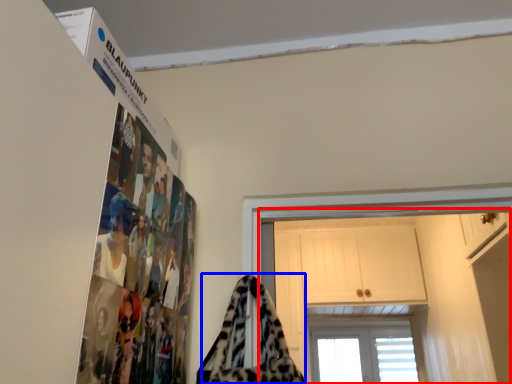
Question: Which of the following is the closest to the observer, dresser (highlighted by a red box) or blanket (highlighted by a blue box)?

Choices:
 (A) dresser
 (B) blanket

Answer: (B)